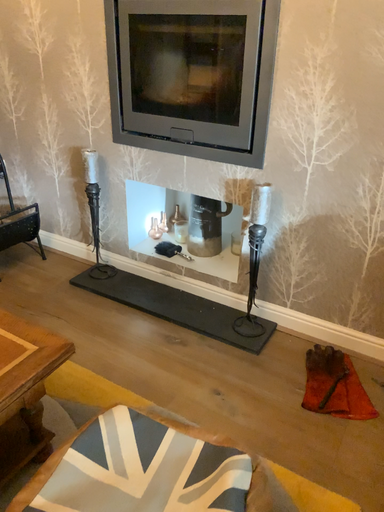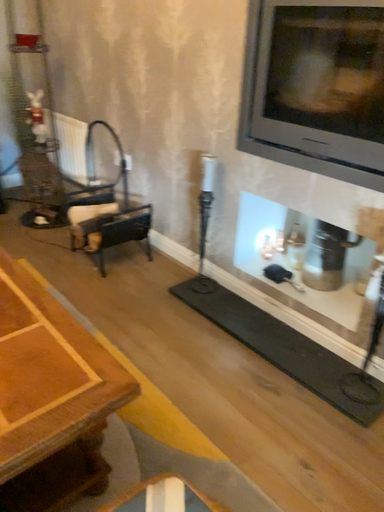
Question: How did the camera likely rotate when shooting the video?

Choices:
 (A) rotated left
 (B) rotated right

Answer: (A)